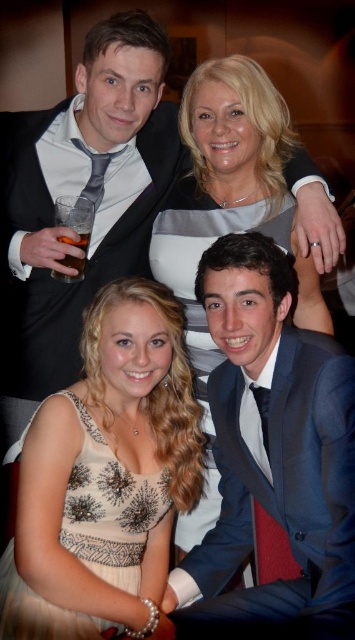
Does blue satin suit at upper center have a smaller size compared to beige sequined dress at lower left?

No.

Who is more forward, (307, 232) or (108, 486)?

Positioned in front is point (108, 486).

Does point (51, 205) come closer to viewer compared to point (128, 593)?

That is False.

Find the location of a particular element. blue satin suit at upper center is located at coordinates (83, 195).

Does blue satin suit at upper center have a lesser height compared to sequined fabric dress at lower left?

In fact, blue satin suit at upper center may be taller than sequined fabric dress at lower left.

Which is in front, point (177, 156) or point (175, 196)?

Positioned in front is point (175, 196).

The image size is (355, 640). Find the location of `blue satin suit at upper center`. blue satin suit at upper center is located at coordinates (83, 195).

Which is in front, point (117, 118) or point (71, 237)?

Point (71, 237)

Which of these two, blue satin suit at upper center or translucent glass at upper left, stands shorter?

translucent glass at upper left

Which is in front, point (155, 115) or point (82, 276)?

Point (82, 276)

Identify the location of blue satin suit at upper center. (83, 195).